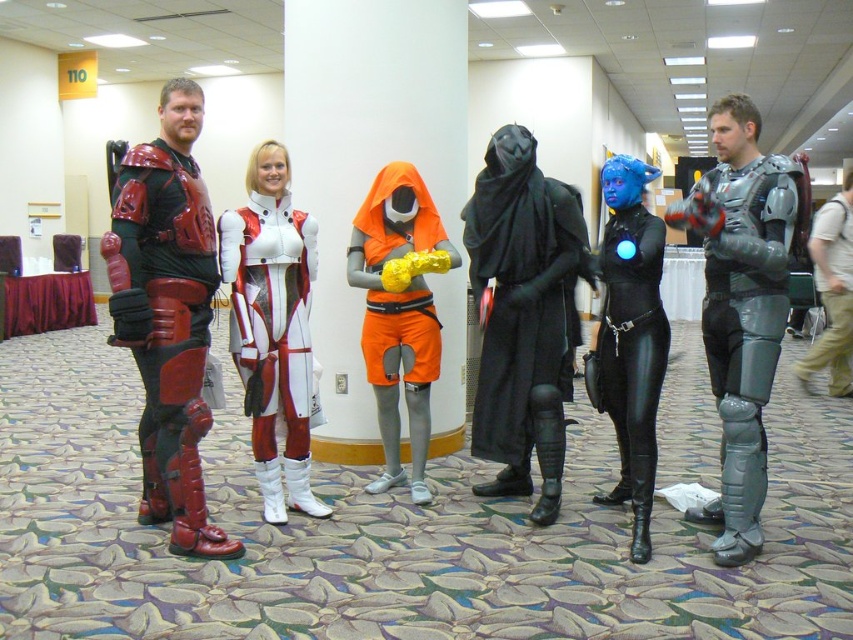
Question: Which point is farther to the camera?

Choices:
 (A) metallic silver armor at right
 (B) black leather bodysuit at center

Answer: (B)

Question: Estimate the real-world distances between objects in this image. Which object is farther from the white glossy bodysuit at center?

Choices:
 (A) orange matte shorts at center
 (B) metallic silver armor at right
 (C) black matte robe at center

Answer: (B)

Question: Does black matte robe at center have a greater width compared to white glossy bodysuit at center?

Choices:
 (A) yes
 (B) no

Answer: (A)

Question: Which of the following is the farthest from the observer?

Choices:
 (A) (184, 348)
 (B) (293, 298)
 (C) (566, 193)

Answer: (C)

Question: Considering the relative positions of shiny red armor at left and black leather bodysuit at center in the image provided, where is shiny red armor at left located with respect to black leather bodysuit at center?

Choices:
 (A) left
 (B) right

Answer: (A)

Question: Is black leather bodysuit at center smaller than orange matte shorts at center?

Choices:
 (A) yes
 (B) no

Answer: (B)